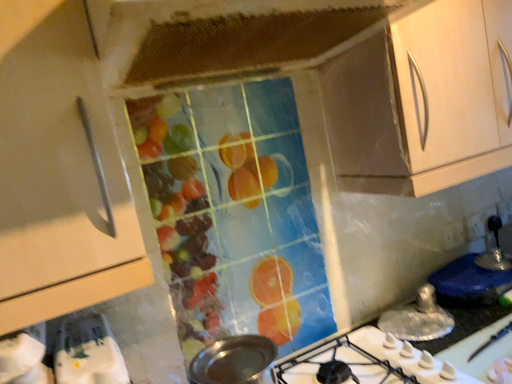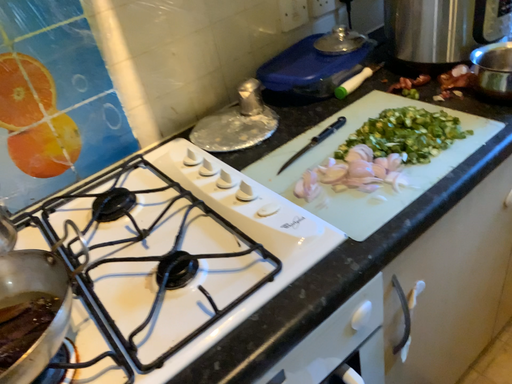
Question: Which way did the camera rotate in the video?

Choices:
 (A) rotated upward
 (B) rotated downward

Answer: (B)